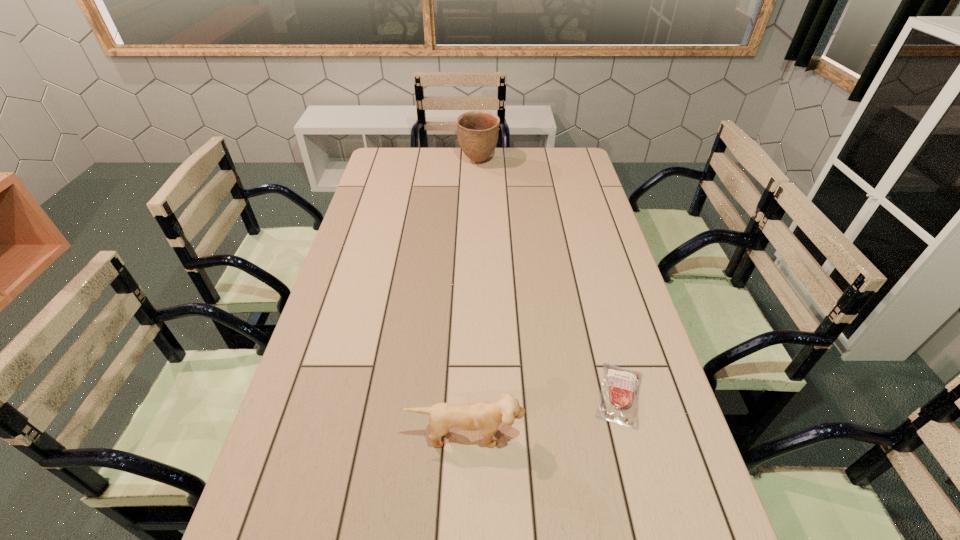
You are a GUI agent. You are given a task and a screenshot of the screen. Output one action in this format:
    pyautogui.click(x=<x>, y=<y>)
    Task: Click on the blank space at the far edge of the desktop
    
    Given the screenshot: What is the action you would take?
    pyautogui.click(x=543, y=164)

In the image, there is a desktop. Where is `free space at the left edge`? The width and height of the screenshot is (960, 540). free space at the left edge is located at coordinates (377, 207).

You are a GUI agent. You are given a task and a screenshot of the screen. Output one action in this format:
    pyautogui.click(x=<x>, y=<y>)
    Task: Click on the vacant region at the right edge
    The image size is (960, 540).
    Given the screenshot: What is the action you would take?
    pyautogui.click(x=629, y=296)

The height and width of the screenshot is (540, 960). Identify the location of free space between the tallest object and the second tallest object. (472, 298).

You are a GUI agent. You are given a task and a screenshot of the screen. Output one action in this format:
    pyautogui.click(x=<x>, y=<y>)
    Task: Click on the vacant space that's between the pottery and the rightmost object
    The image size is (960, 540).
    Given the screenshot: What is the action you would take?
    pyautogui.click(x=549, y=278)

Where is `vacant area that lies between the second shortest object and the farthest object`? vacant area that lies between the second shortest object and the farthest object is located at coordinates (472, 298).

This screenshot has height=540, width=960. I want to click on vacant area that lies between the tallest object and the second shortest object, so click(472, 298).

At what (x,y) coordinates should I click in order to perform the action: click on free space between the pottery and the steak. Please return your answer as a coordinate pair (x, y). The image size is (960, 540). Looking at the image, I should click on (549, 278).

Identify the location of free space between the tallest object and the puppy. This screenshot has height=540, width=960. (472, 298).

This screenshot has height=540, width=960. Find the location of `blank region between the farthest object and the steak`. blank region between the farthest object and the steak is located at coordinates (549, 278).